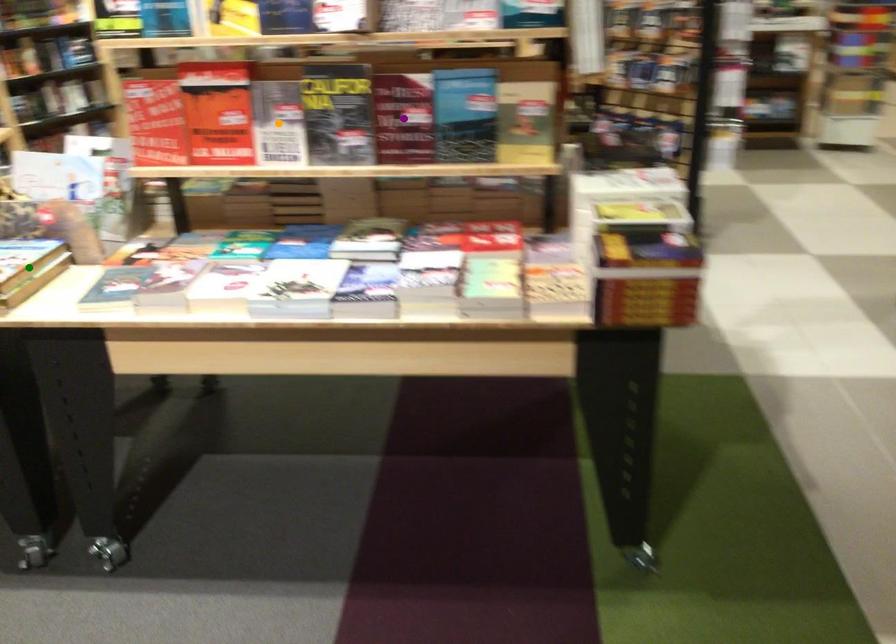
Order these from farthest to nearest:
- orange point
- green point
- purple point

orange point → purple point → green point